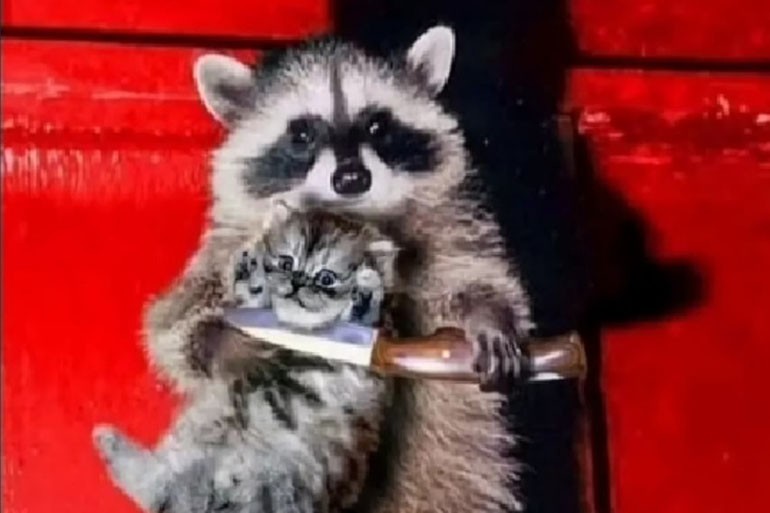
The width and height of the screenshot is (770, 513). Identify the location of red background wall. (85, 307), (671, 447), (688, 44), (213, 31).